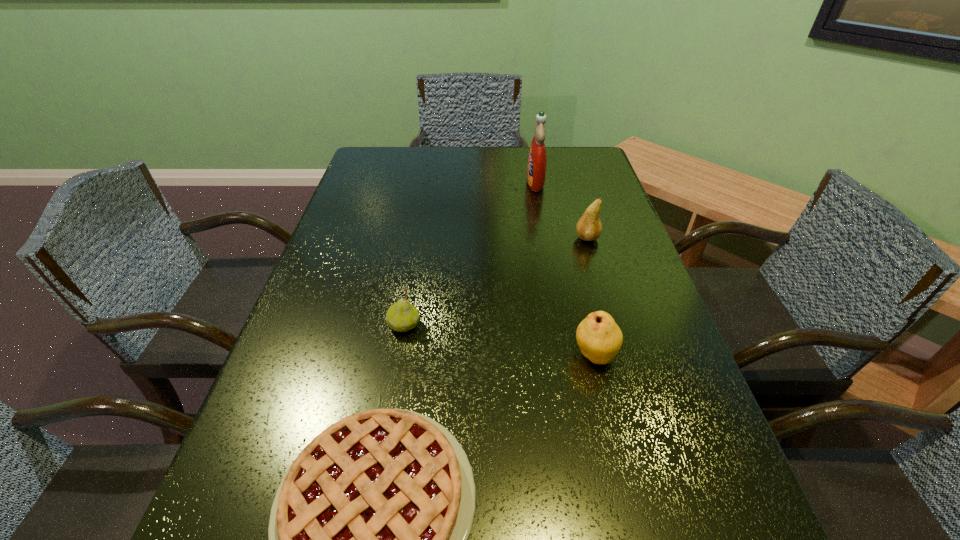
The width and height of the screenshot is (960, 540). I want to click on vacant space located on the front of the nearest pear, so click(628, 492).

You are a GUI agent. You are given a task and a screenshot of the screen. Output one action in this format:
    pyautogui.click(x=<x>, y=<y>)
    Task: Click on the vacant area located 0.140m on the right of the third farthest object
    This screenshot has width=960, height=540.
    Given the screenshot: What is the action you would take?
    pyautogui.click(x=488, y=326)

The width and height of the screenshot is (960, 540). Identify the location of object that is positioned at the far edge. (537, 159).

You are a GUI agent. You are given a task and a screenshot of the screen. Output one action in this format:
    pyautogui.click(x=<x>, y=<y>)
    Task: Click on the free space at the far edge of the desktop
    The width and height of the screenshot is (960, 540).
    Given the screenshot: What is the action you would take?
    pyautogui.click(x=417, y=153)

This screenshot has width=960, height=540. In the image, there is a desktop. What are the coordinates of `free space at the left edge` in the screenshot? It's located at (323, 297).

Locate an element on the screen. vacant region at the right edge of the desktop is located at coordinates (727, 497).

The image size is (960, 540). Find the location of `free region at the far left corner of the desktop`. free region at the far left corner of the desktop is located at coordinates click(x=388, y=147).

I want to click on vacant area that lies between the farthest object and the nearest pear, so click(x=564, y=268).

Find the location of a particular element. The height and width of the screenshot is (540, 960). free space between the detergent and the farthest pear is located at coordinates (562, 210).

I want to click on vacant point located between the third nearest object and the farthest object, so click(469, 254).